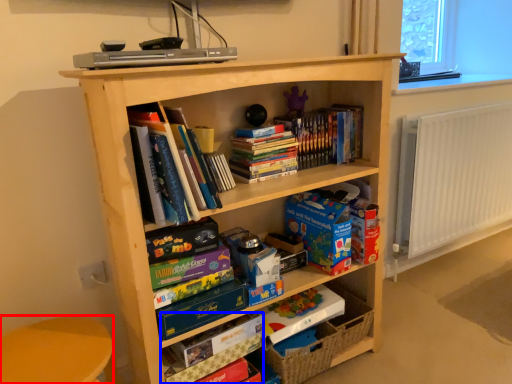
Question: Which of the following is the closest to the observer, armchair (highlighted by a red box) or paperback book (highlighted by a blue box)?

Choices:
 (A) armchair
 (B) paperback book

Answer: (A)